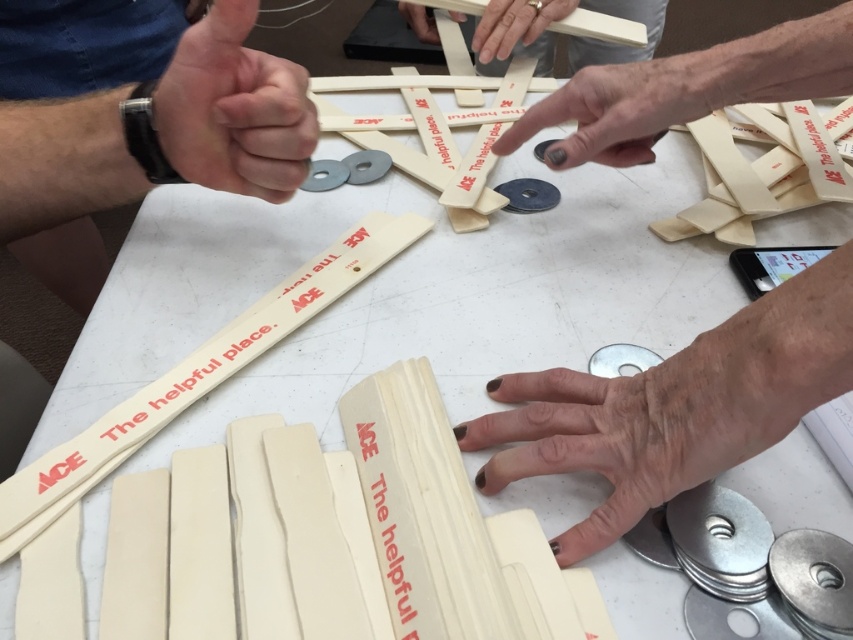
In the scene shown: You are a project manager overseeing the assembly process. You notice two items on the table at the upper center area. One is a matte white finger and the other is a matte wood stick. The safety guidelines require that all tools must be kept at least 12 inches away from any fingers to prevent accidents. Are the current positions of the matte white finger at upper center and the matte wood stick at upper center compliant with the safety guidelines?

The distance between the matte white finger at upper center and the matte wood stick at upper center is 13.67 inches, which exceeds the required 12 inches. Therefore, the current positions comply with the safety guidelines.